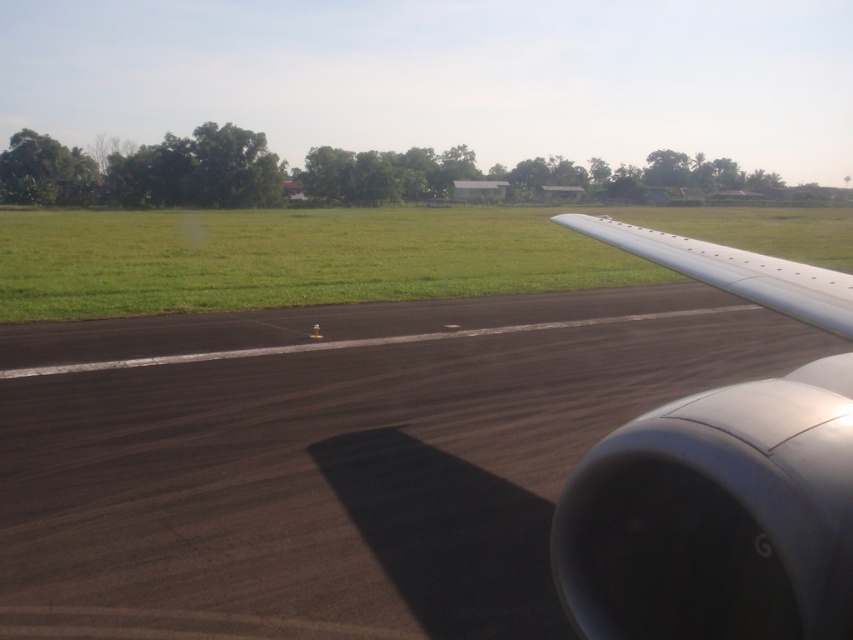
Which is more to the right, metallic gray wing at right or silver metallic wing at right?

From the viewer's perspective, silver metallic wing at right appears more on the right side.

Is point (761, 502) positioned behind point (717, 273)?

No, (761, 502) is closer to viewer.

The width and height of the screenshot is (853, 640). I want to click on metallic gray wing at right, so click(x=717, y=515).

Consider the image. Can you confirm if black asphalt runway at center is positioned to the right of metallic gray wing at right?

No, black asphalt runway at center is not to the right of metallic gray wing at right.

The width and height of the screenshot is (853, 640). Describe the element at coordinates (334, 458) in the screenshot. I see `black asphalt runway at center` at that location.

The width and height of the screenshot is (853, 640). In order to click on black asphalt runway at center in this screenshot , I will do `click(334, 458)`.

Does black asphalt runway at center have a smaller size compared to green grass at center?

Correct, black asphalt runway at center occupies less space than green grass at center.

Image resolution: width=853 pixels, height=640 pixels. What do you see at coordinates (334, 458) in the screenshot? I see `black asphalt runway at center` at bounding box center [334, 458].

Image resolution: width=853 pixels, height=640 pixels. Describe the element at coordinates (334, 458) in the screenshot. I see `black asphalt runway at center` at that location.

Locate an element on the screen. Image resolution: width=853 pixels, height=640 pixels. black asphalt runway at center is located at coordinates coord(334,458).